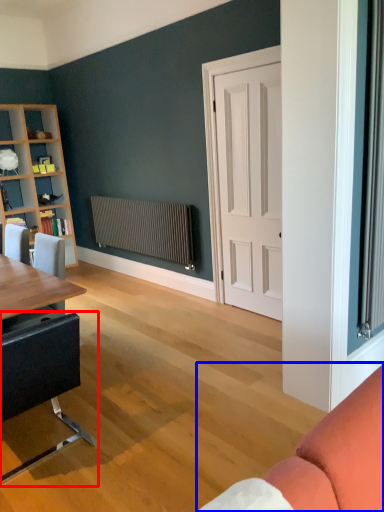
Question: Among these objects, which one is farthest to the camera, chair (highlighted by a red box) or studio couch (highlighted by a blue box)?

Choices:
 (A) chair
 (B) studio couch

Answer: (A)